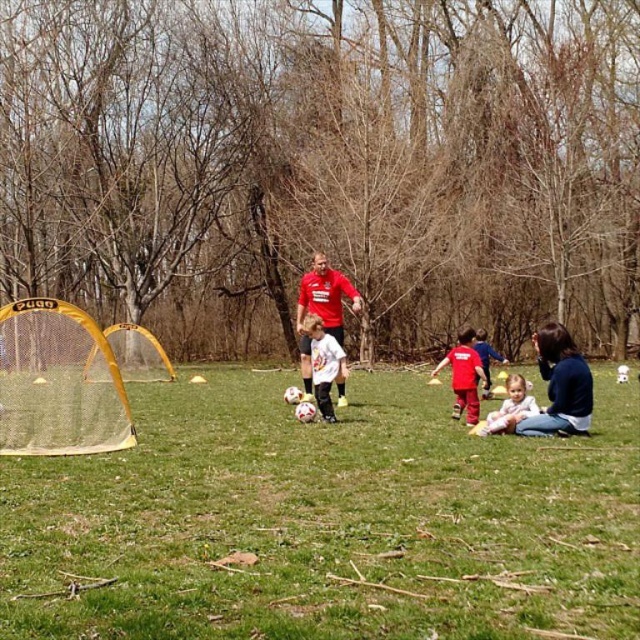
You are a soccer coach observing the game and need to decide which object is higher in the image. Which one is taller between the matte red shirt at center and the white matte soccer ball at center?

The matte red shirt at center is much taller than the white matte soccer ball at center.

You are a photographer standing at the center of the soccer field and want to take a photo of both the soccer goal and the two points marked in the image. Which point, point (58, 552) or point (529, 397), is closer to you?

Point (58, 552) is closer to you than point (529, 397).